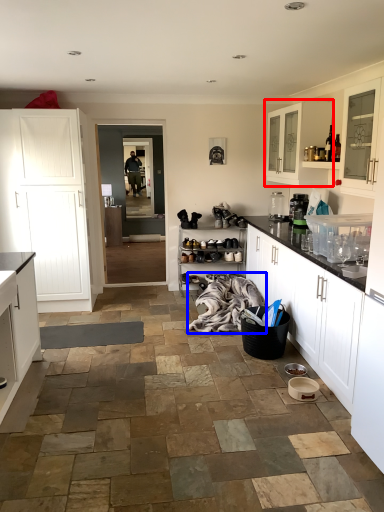
Question: Among these objects, which one is nearest to the camera, cabinetry (highlighted by a red box) or blanket (highlighted by a blue box)?

Choices:
 (A) cabinetry
 (B) blanket

Answer: (B)